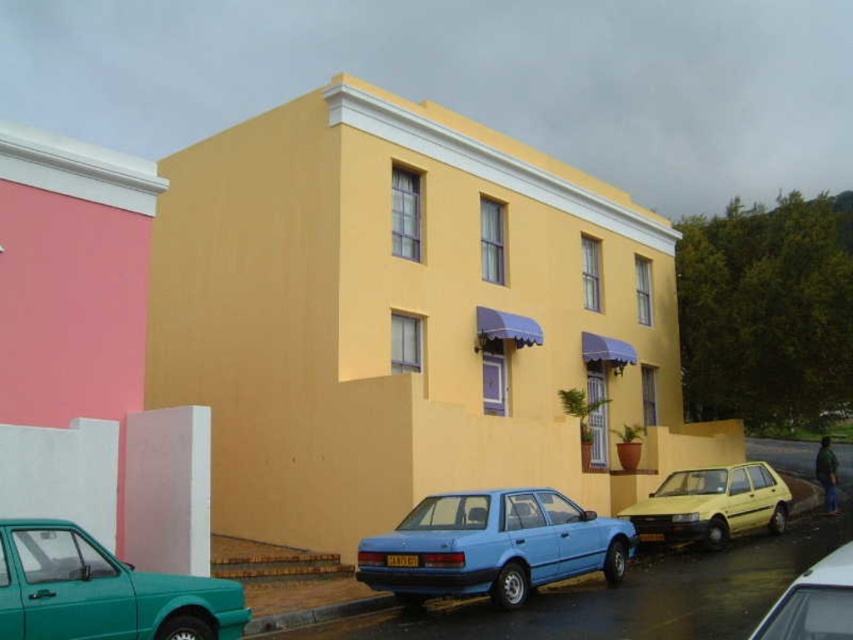
Question: Which object appears closest to the camera in this image?

Choices:
 (A) matte blue sedan at center
 (B) metallic silver car at lower right

Answer: (B)

Question: Can you confirm if yellow matte car at lower right is positioned above metallic silver car at lower right?

Choices:
 (A) no
 (B) yes

Answer: (A)

Question: Can you confirm if yellow matte car at lower right is positioned to the left of metallic silver car at lower right?

Choices:
 (A) no
 (B) yes

Answer: (A)

Question: Estimate the real-world distances between objects in this image. Which object is closer to the matte blue sedan at center?

Choices:
 (A) yellow matte car at lower right
 (B) metallic silver car at lower right

Answer: (A)

Question: Is matte blue sedan at center above yellow matte car at lower right?

Choices:
 (A) yes
 (B) no

Answer: (A)

Question: Which object is closer to the camera taking this photo?

Choices:
 (A) teal glossy hatchback at lower left
 (B) matte blue sedan at center

Answer: (A)